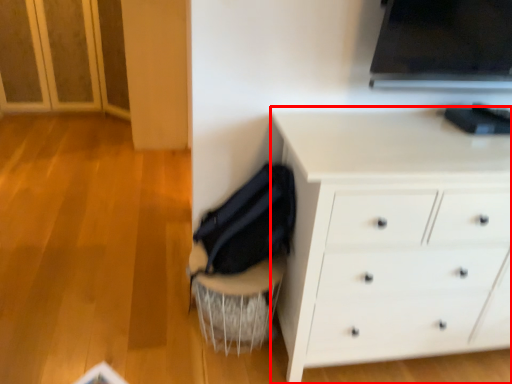
Question: From the image's perspective, what is the correct spatial positioning of chest of drawers (annotated by the red box) in reference to swivel chair?

Choices:
 (A) below
 (B) above

Answer: (B)